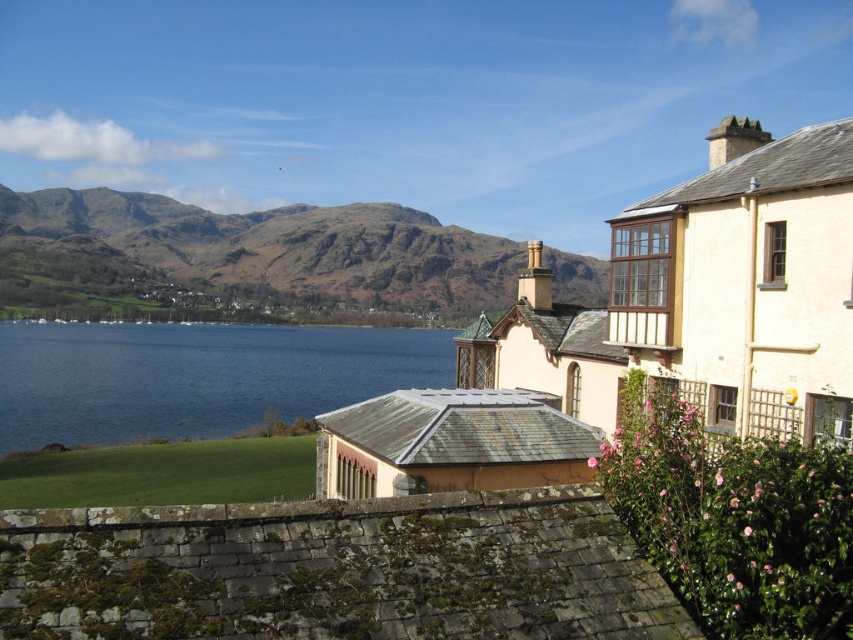
You are an artist planning to paint this scene. You want to ensure the brown rocky mountain at upper left and the blue water at lower left are proportionally accurate. Which object should you make wider in your painting?

The brown rocky mountain at upper left should be made wider than the blue water at lower left since its width surpasses the water.

You are a hiker planning to cross from the brown rocky mountain at upper left to the blue water at lower left. The path you intend to take is 100 meters long. Based on the scene description, will you be able to complete the journey without needing to backtrack or take a detour?

The distance between the brown rocky mountain at upper left and the blue water at lower left is 96.79 meters. Since your planned path is 100 meters long, which is slightly longer than the straight line distance, you should be able to complete the journey without needing to backtrack or detour as long as the terrain allows following that path.